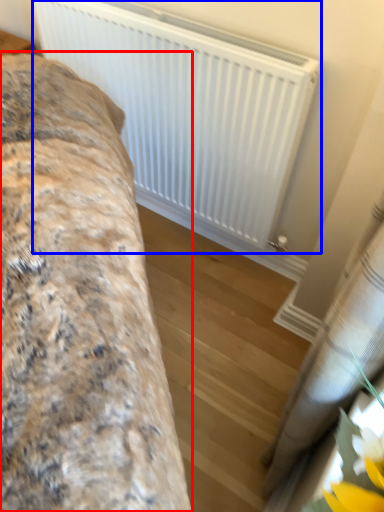
Question: Which point is further to the camera, furniture (highlighted by a red box) or radiator (highlighted by a blue box)?

Choices:
 (A) furniture
 (B) radiator

Answer: (B)